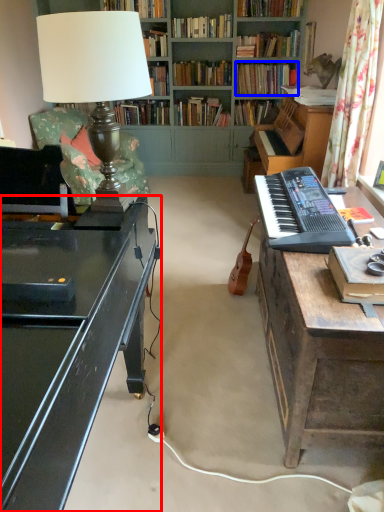
Question: Which object appears closest to the camera in this image, desk (highlighted by a red box) or book (highlighted by a blue box)?

Choices:
 (A) desk
 (B) book

Answer: (A)